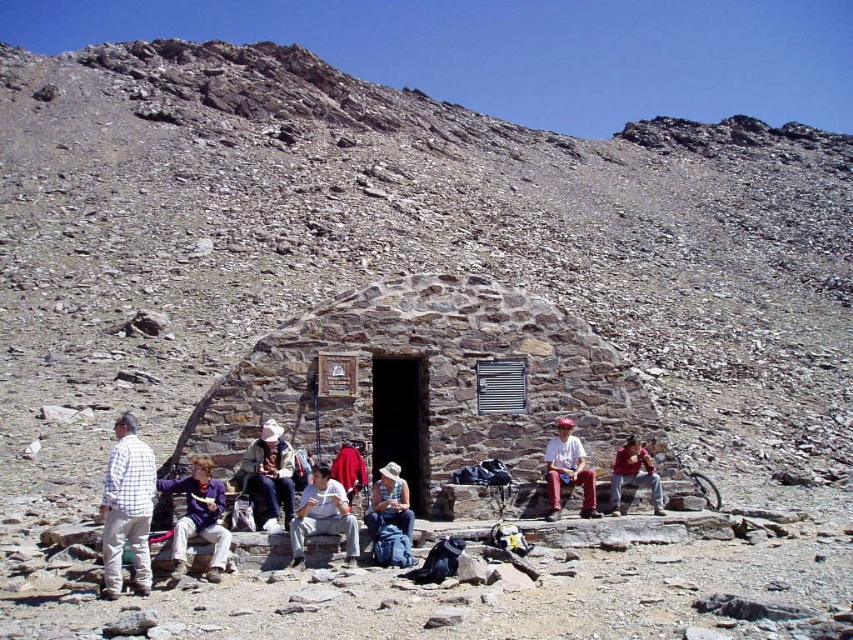
Based on the photo, you are a hiker trying to decide which person to follow up the steep slope. You see a person wearing a white checkered shirt at center and another wearing a purple fleece jacket at center. Which person would be easier to keep up with based on their height?

The white checkered shirt at center is much taller than the purple fleece jacket at center, so the person in the purple fleece jacket at center may be easier to keep up with due to potentially shorter strides.

From the picture: You are planning to take a photo of the stone textured hut at center and the red fabric shirt at center. Which object should you focus on first to ensure both are in frame without moving the camera?

The stone textured hut at center is positioned over the red fabric shirt at center, so you should focus on the stone textured hut at center first to ensure both are in frame without moving the camera.

You are standing at the shelter and want to move towards the point marked as point (198, 529). Is this point closer to you than the point marked as point (653, 508)?

Yes, the point (198, 529) is in front of point (653, 508), so it is closer to you.